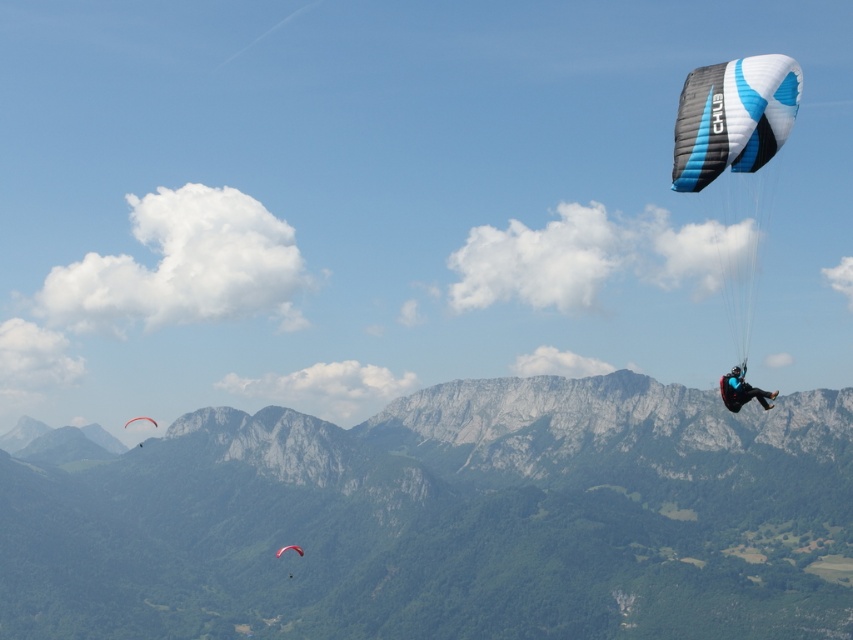
Question: Observing the image, what is the correct spatial positioning of green textured mountain at center in reference to matte blue parachute at upper right?

Choices:
 (A) below
 (B) above

Answer: (A)

Question: Based on their relative distances, which object is farther from the green textured mountain at center?

Choices:
 (A) matte blue parachute at upper right
 (B) matte black parachute at lower left

Answer: (A)

Question: Where is blue/white fabric parachute at right located in relation to matte black parachute at lower left in the image?

Choices:
 (A) below
 (B) above

Answer: (B)

Question: Which point is closer to the camera?

Choices:
 (A) (492, 584)
 (B) (302, 554)
 (C) (125, 426)
 (D) (772, 394)

Answer: (D)

Question: Which of the following is the farthest from the observer?

Choices:
 (A) matte pink parachute at upper right
 (B) green textured mountain at center
 (C) blue/white fabric parachute at right
 (D) matte black parachute at lower left

Answer: (D)

Question: Does green textured mountain at center have a lesser width compared to matte black parachute at lower left?

Choices:
 (A) yes
 (B) no

Answer: (B)